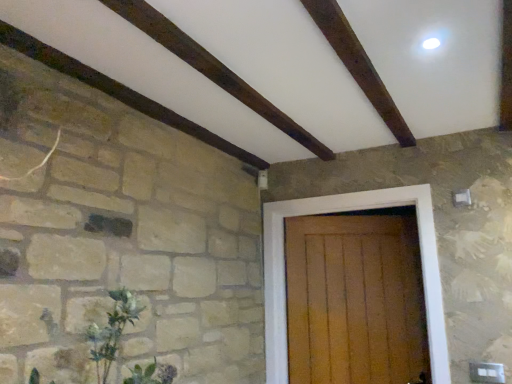
Question: Is wooden door at center to the left or to the right of green leafy plant at lower left in the image?

Choices:
 (A) left
 (B) right

Answer: (B)

Question: From a real-world perspective, relative to green leafy plant at lower left, is wooden door at center vertically above or below?

Choices:
 (A) below
 (B) above

Answer: (B)

Question: Is wooden door at center spatially inside green leafy plant at lower left, or outside of it?

Choices:
 (A) inside
 (B) outside

Answer: (B)

Question: Based on their positions, is green leafy plant at lower left located to the left or right of wooden door at center?

Choices:
 (A) left
 (B) right

Answer: (A)

Question: From a real-world perspective, is green leafy plant at lower left physically located above or below wooden door at center?

Choices:
 (A) above
 (B) below

Answer: (B)

Question: From the image's perspective, is green leafy plant at lower left above or below wooden door at center?

Choices:
 (A) below
 (B) above

Answer: (B)

Question: Which is correct: green leafy plant at lower left is inside wooden door at center, or outside of it?

Choices:
 (A) inside
 (B) outside

Answer: (B)